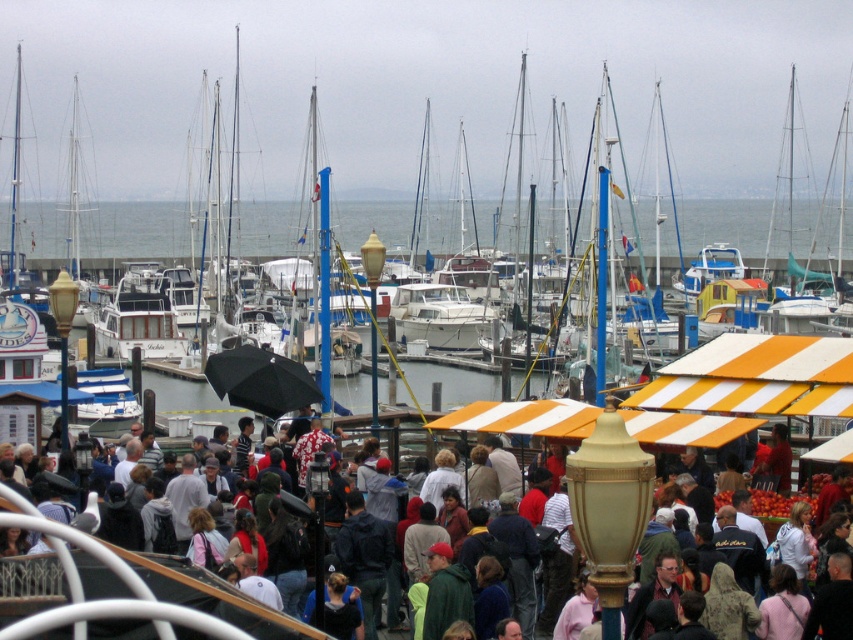
Is point (526, 61) farther from viewer compared to point (614, 504)?

Yes, point (526, 61) is behind point (614, 504).

Between white glossy boat at center and multicolored fabric crowd at center, which one has less height?

With less height is multicolored fabric crowd at center.

Is point (438, 68) positioned in front of point (219, 636)?

No, it is not.

The image size is (853, 640). I want to click on white glossy boat at center, so click(x=538, y=116).